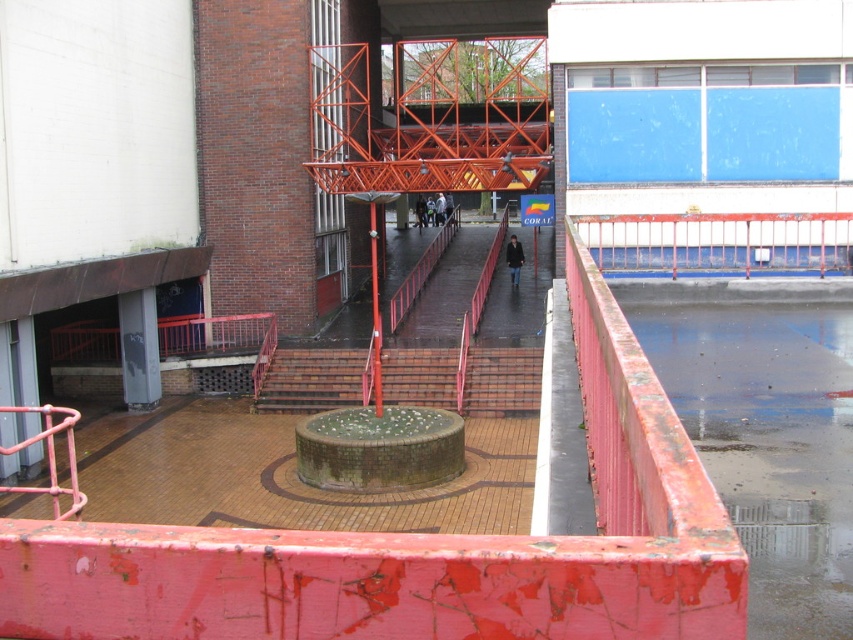
You are standing on the walkway and want to take a photo of the building entrance. Which rusty metal railing should you move closer to for a better view? The rusty metal railing at center or the rusty metal railing at upper right?

You should move closer to the rusty metal railing at center because it is closer to the viewer, providing a better vantage point for photographing the building entrance.